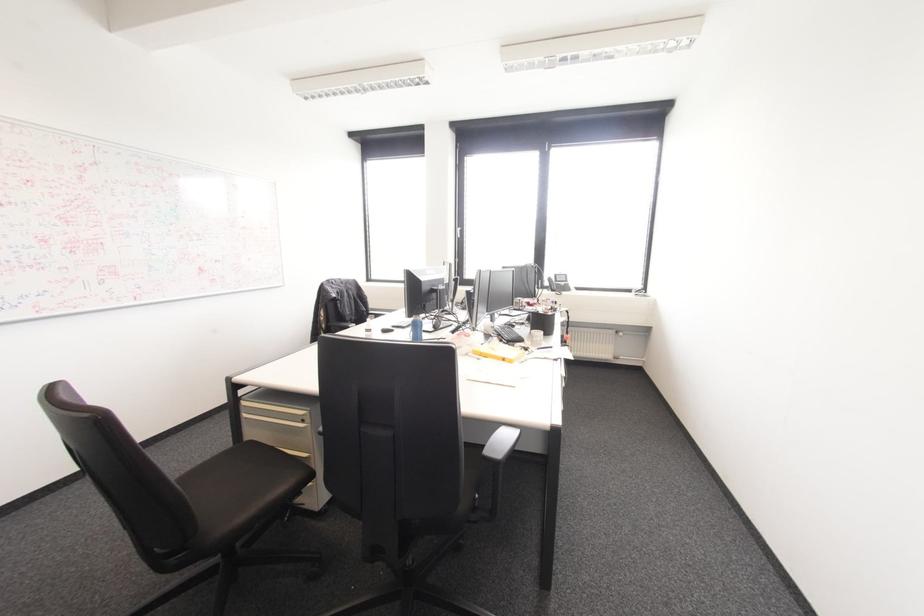
Find where to pull the cabinet drawer handle. Please return your answer as a coordinate pair (x, y).

(277, 415)